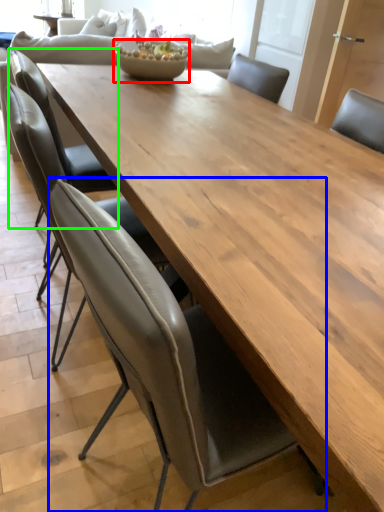
Question: Which object is the closest to the salad bowl (highlighted by a red box)? Choose among these: chair (highlighted by a blue box) or chair (highlighted by a green box).

Choices:
 (A) chair
 (B) chair

Answer: (B)